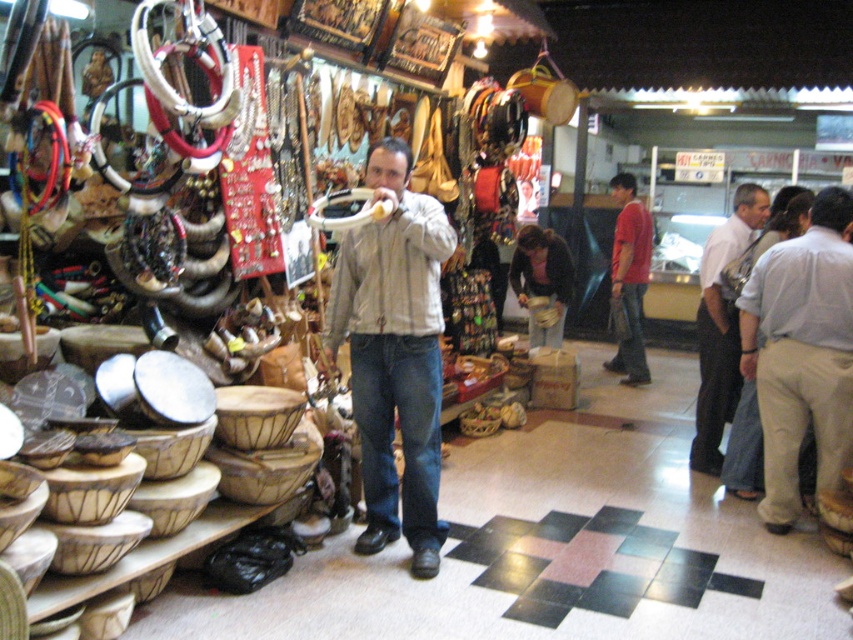
You are standing at the entrance of the market and want to locate the light gray shirt at center. Based on the coordinates provided, where should you look relative to the center of the image?

The light gray shirt at center is located at coordinates approximately 55.3 percent along the horizontal axis and 94.0 percent along the vertical axis from the bottom left corner of the image.

You are a customer in the market and want to ask the man about the wooden bowls displayed to the left. Which item should you point to first, the light gray shirt at center or the light brown leather tie at right, to get his attention?

You should point to the light brown leather tie at right first because it is located above the light gray shirt at center, making it more visible to the man.